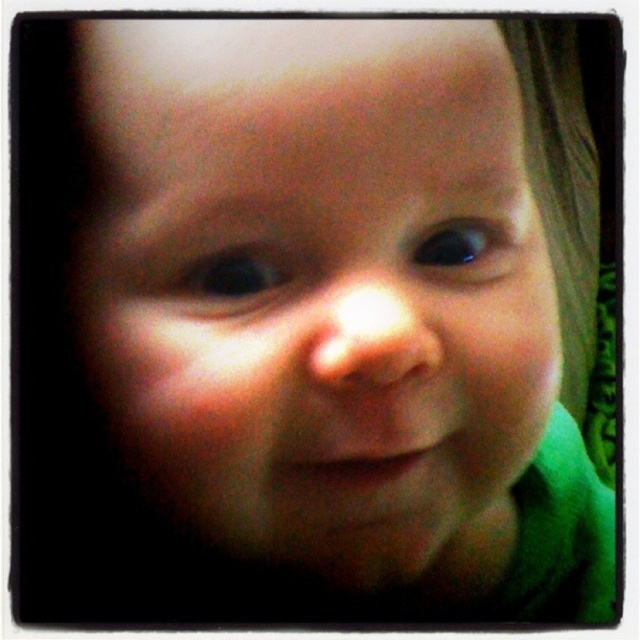
Consider the image. You are a photographer trying to adjust the focus of your camera. The image shows a baby with a slightly out of focus face. There is a point at coordinates [232,275]. Based on the scene description, where is this point located?

The point at [232,275] is on the blue glossy eye at center.

You are holding a 10 inch ruler and want to measure the distance between yourself and the point at coordinates point (218, 257) in the image. Can you determine if the distance is within the ruler length?

The distance between you and the point at coordinates point (218, 257) is 9.59 inches, which is within the 10 inch ruler length.

You are a photographer trying to adjust the focus of your camera. The smooth skin baby at center is currently slightly out of focus. According to the coordinates given, where should you adjust the focus point to ensure the baby is in sharp focus?

The smooth skin baby at center is already positioned at the focus point coordinates of (317, 285), so adjusting the focus there will sharpen the image.